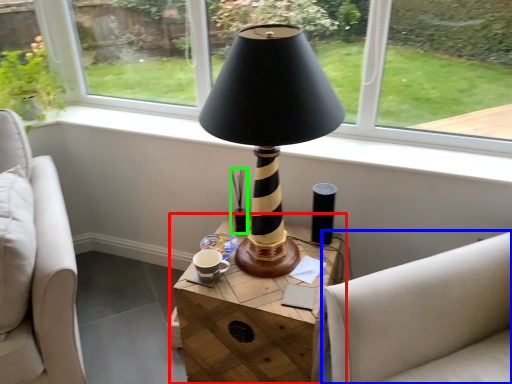
Question: Which object is the closest to the table (highlighted by a red box)? Choose among these: studio couch (highlighted by a blue box) or candle holder (highlighted by a green box).

Choices:
 (A) studio couch
 (B) candle holder

Answer: (A)